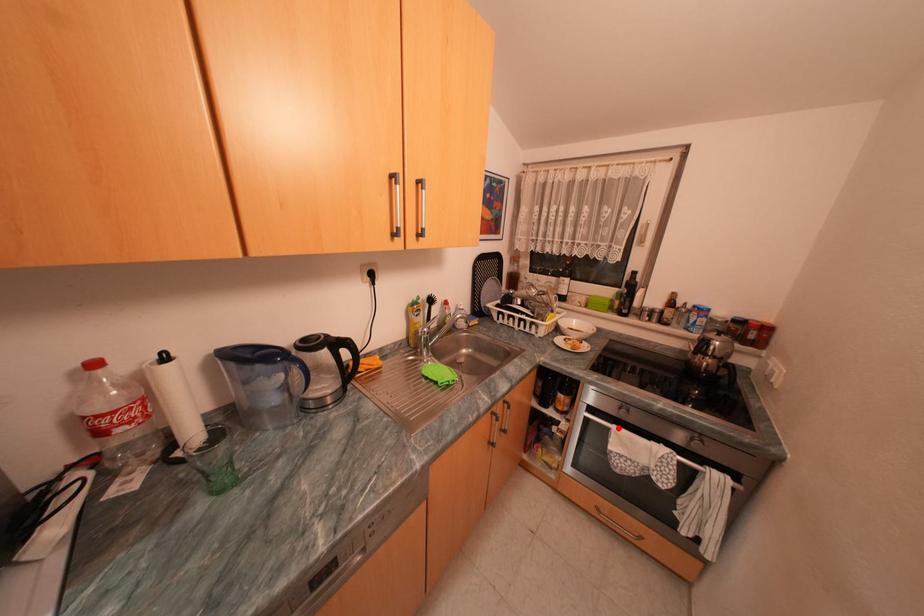
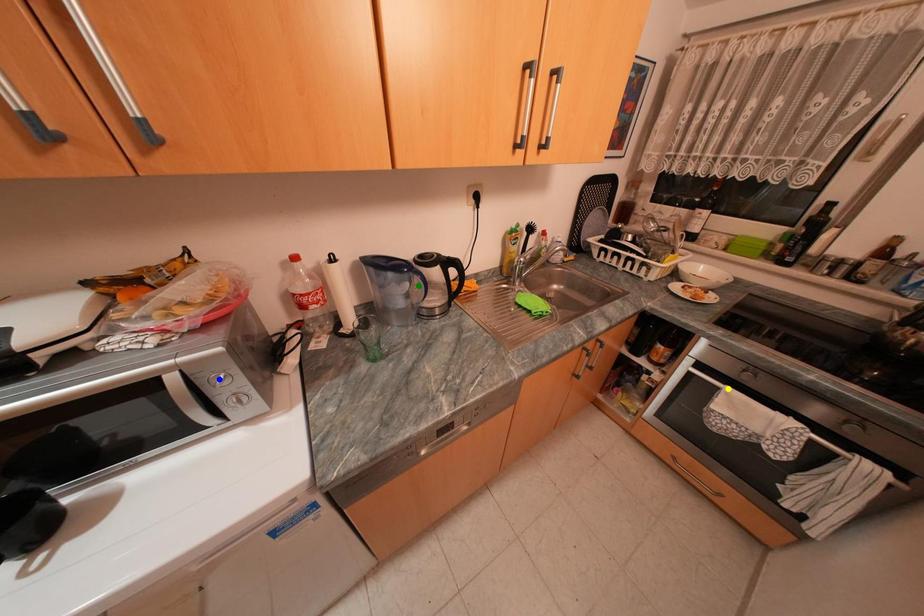
Question: I am providing you with two images of the same scene from different viewpoints. A red point is marked on the first image. You are given multiple points on the second image. Can you choose the point in image 2 that corresponds to the point in image 1?

Choices:
 (A) blue point
 (B) green point
 (C) yellow point

Answer: (C)